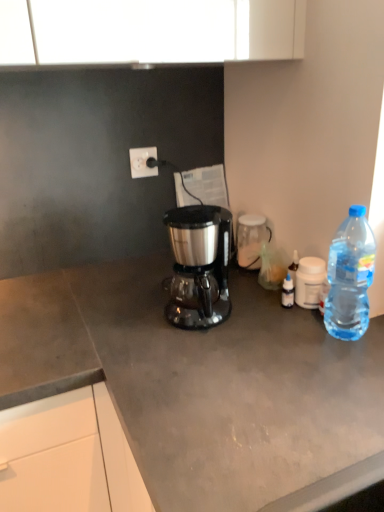
Locate an element on the screen. The height and width of the screenshot is (512, 384). free region on the left part of transparent plastic coffee cup at right, the first coffee cup positioned from the front is located at coordinates (253, 305).